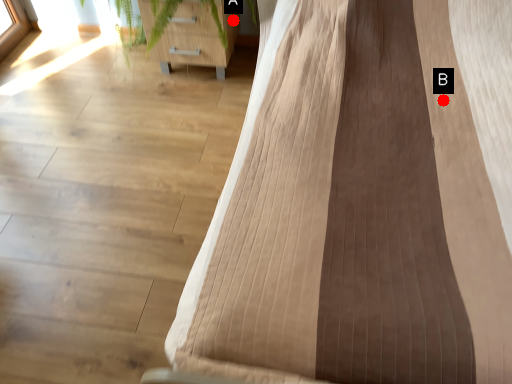
Question: Two points are circled on the image, labeled by A and B beside each circle. Which point appears closest to the camera in this image?

Choices:
 (A) A is closer
 (B) B is closer

Answer: (B)